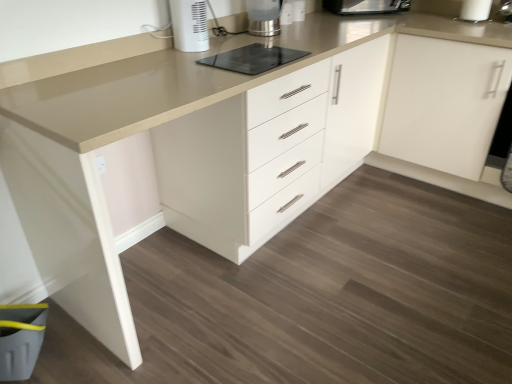
Question: Is white plastic heater at upper center, acting as the 2th home appliance starting from the right, completely or partially inside metallic silver kettle at upper center, the first home appliance positioned from the back?

Choices:
 (A) no
 (B) yes

Answer: (A)

Question: Considering the relative positions of metallic silver kettle at upper center, which is the 2th home appliance from left to right, and white plastic heater at upper center, acting as the 2th home appliance starting from the right, in the image provided, is metallic silver kettle at upper center, which is the 2th home appliance from left to right, to the left of white plastic heater at upper center, acting as the 2th home appliance starting from the right, from the viewer's perspective?

Choices:
 (A) no
 (B) yes

Answer: (A)

Question: From a real-world perspective, is metallic silver kettle at upper center, which is the 2th home appliance from left to right, on white plastic heater at upper center, which is counted as the first home appliance, starting from the left?

Choices:
 (A) yes
 (B) no

Answer: (B)

Question: Is metallic silver kettle at upper center, which is the second home appliance from front to back, bigger than white plastic heater at upper center, acting as the 2th home appliance starting from the right?

Choices:
 (A) no
 (B) yes

Answer: (B)

Question: Is the position of metallic silver kettle at upper center, which is the 2th home appliance from left to right, more distant than that of white plastic heater at upper center, the 1th home appliance in the front-to-back sequence?

Choices:
 (A) yes
 (B) no

Answer: (A)

Question: Is metallic silver kettle at upper center, the first home appliance positioned from the back, far from white plastic heater at upper center, the 1th home appliance in the front-to-back sequence?

Choices:
 (A) yes
 (B) no

Answer: (B)

Question: Is metallic silver kettle at upper center, which is the 2th home appliance from left to right, far from white matte cabinet at upper right?

Choices:
 (A) yes
 (B) no

Answer: (B)

Question: Is metallic silver kettle at upper center, the first home appliance positioned from the back, outside of white matte cabinet at upper right?

Choices:
 (A) yes
 (B) no

Answer: (A)

Question: From a real-world perspective, is metallic silver kettle at upper center, which is the 2th home appliance from left to right, positioned over white matte cabinet at upper right based on gravity?

Choices:
 (A) no
 (B) yes

Answer: (B)

Question: Can you confirm if metallic silver kettle at upper center, the first home appliance positioned from the back, is wider than white matte cabinet at upper right?

Choices:
 (A) no
 (B) yes

Answer: (A)

Question: Is metallic silver kettle at upper center, which is the second home appliance from front to back, taller than white matte cabinet at upper right?

Choices:
 (A) no
 (B) yes

Answer: (A)

Question: Does metallic silver kettle at upper center, the first home appliance positioned from the back, have a larger size compared to white matte cabinet at upper right?

Choices:
 (A) no
 (B) yes

Answer: (A)

Question: Does black glass cooktop at center have a larger size compared to metallic silver kettle at upper center, the first home appliance in the right-to-left sequence?

Choices:
 (A) no
 (B) yes

Answer: (A)